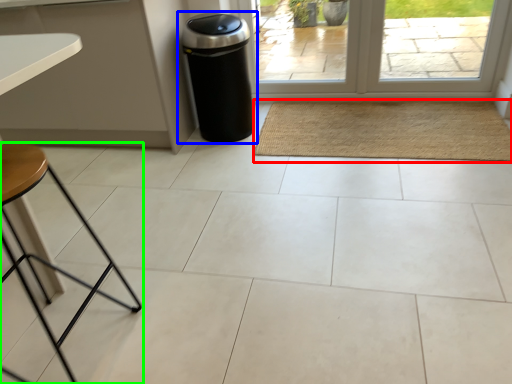
Question: Which is farther away from mat (highlighted by a red box)? waste container (highlighted by a blue box) or furniture (highlighted by a green box)?

Choices:
 (A) waste container
 (B) furniture

Answer: (B)